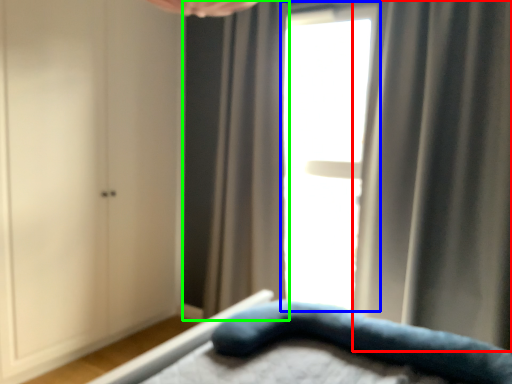
Question: Based on their relative distances, which object is farther from curtain (highlighted by a red box)? Choose from window (highlighted by a blue box) and curtain (highlighted by a green box).

Choices:
 (A) window
 (B) curtain

Answer: (B)